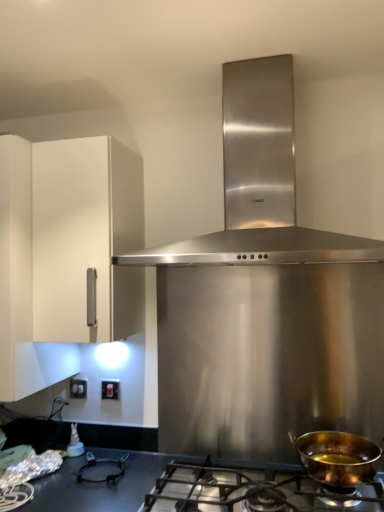
Question: From the image's perspective, is stainless steel range hood at center positioned above or below white matte cabinet at left?

Choices:
 (A) above
 (B) below

Answer: (A)

Question: Is stainless steel range hood at center inside the boundaries of white matte cabinet at left, or outside?

Choices:
 (A) inside
 (B) outside

Answer: (B)

Question: Considering the real-world distances, which object is farthest from the stainless steel range hood at center?

Choices:
 (A) shiny metallic gas stove at lower center
 (B) white matte cabinet at left
 (C) matte black switch at lower left, which is counted as the second electric outlet, starting from the back
 (D) shiny copper pan at lower right
 (E) white plastic electric outlet at lower left, the second electric outlet in the right-to-left sequence

Answer: (E)

Question: Which object is positioned farthest from the stainless steel range hood at center?

Choices:
 (A) shiny metallic gas stove at lower center
 (B) matte black switch at lower left, which is counted as the second electric outlet, starting from the back
 (C) white matte cabinet at left
 (D) shiny copper pan at lower right
 (E) white plastic electric outlet at lower left, which is the 1th electric outlet in back-to-front order

Answer: (E)